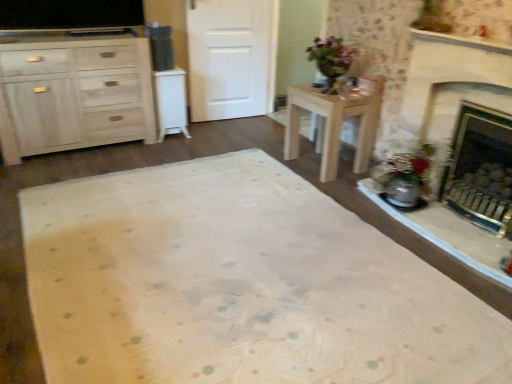
Question: Can you confirm if white matte cabinet at left, marked as the 1th cabinetry in a right-to-left arrangement, is taller than brass fireplace at right?

Choices:
 (A) no
 (B) yes

Answer: (A)

Question: Are white matte cabinet at left, marked as the 1th cabinetry in a right-to-left arrangement, and brass fireplace at right beside each other?

Choices:
 (A) no
 (B) yes

Answer: (A)

Question: Is brass fireplace at right at the back of white matte cabinet at left, marked as the 1th cabinetry in a right-to-left arrangement?

Choices:
 (A) yes
 (B) no

Answer: (B)

Question: Considering the relative positions of white matte cabinet at left, marked as the 1th cabinetry in a right-to-left arrangement, and brass fireplace at right in the image provided, is white matte cabinet at left, marked as the 1th cabinetry in a right-to-left arrangement, to the left of brass fireplace at right from the viewer's perspective?

Choices:
 (A) no
 (B) yes

Answer: (B)

Question: From a real-world perspective, is white matte cabinet at left, positioned as the 2th cabinetry in left-to-right order, located higher than brass fireplace at right?

Choices:
 (A) no
 (B) yes

Answer: (A)

Question: In terms of height, does brass fireplace at right look taller or shorter compared to white matte cabinet at left, marked as the 1th cabinetry in a right-to-left arrangement?

Choices:
 (A) tall
 (B) short

Answer: (A)

Question: In terms of size, does brass fireplace at right appear bigger or smaller than white matte cabinet at left, positioned as the 2th cabinetry in left-to-right order?

Choices:
 (A) big
 (B) small

Answer: (A)

Question: Visually, is brass fireplace at right positioned to the left or to the right of white matte cabinet at left, positioned as the 2th cabinetry in left-to-right order?

Choices:
 (A) left
 (B) right

Answer: (B)

Question: From a real-world perspective, is brass fireplace at right above or below white matte cabinet at left, positioned as the 2th cabinetry in left-to-right order?

Choices:
 (A) below
 (B) above

Answer: (B)

Question: In terms of size, does brass fireplace at right appear bigger or smaller than white matte door at center?

Choices:
 (A) small
 (B) big

Answer: (B)

Question: From the image's perspective, is brass fireplace at right above or below white matte door at center?

Choices:
 (A) above
 (B) below

Answer: (B)

Question: In the image, is brass fireplace at right on the left side or the right side of white matte door at center?

Choices:
 (A) left
 (B) right

Answer: (B)

Question: From a real-world perspective, is brass fireplace at right above or below white matte door at center?

Choices:
 (A) below
 (B) above

Answer: (A)

Question: From the image's perspective, is white matte door at center above or below brass fireplace at right?

Choices:
 (A) above
 (B) below

Answer: (A)

Question: Considering their positions, is white matte door at center located in front of or behind brass fireplace at right?

Choices:
 (A) front
 (B) behind

Answer: (B)